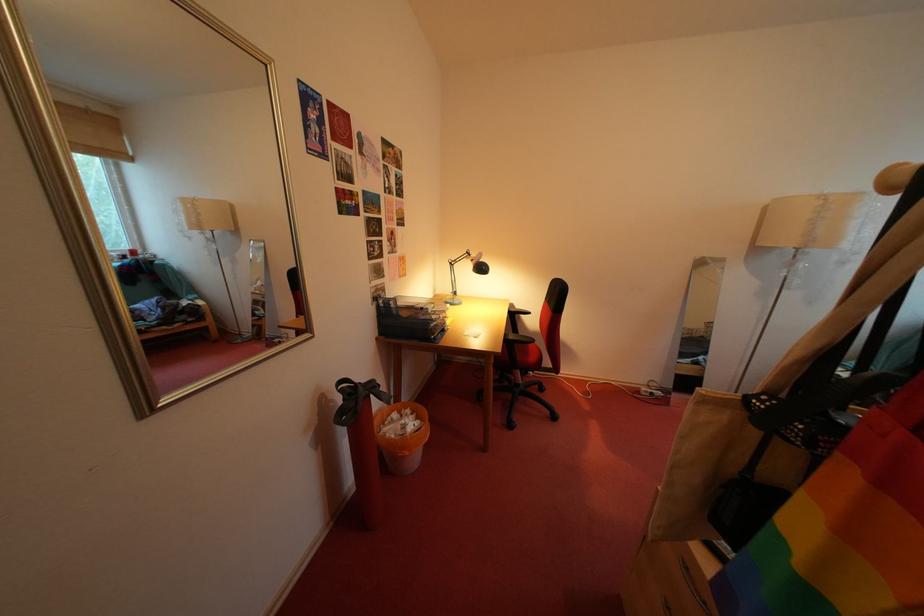
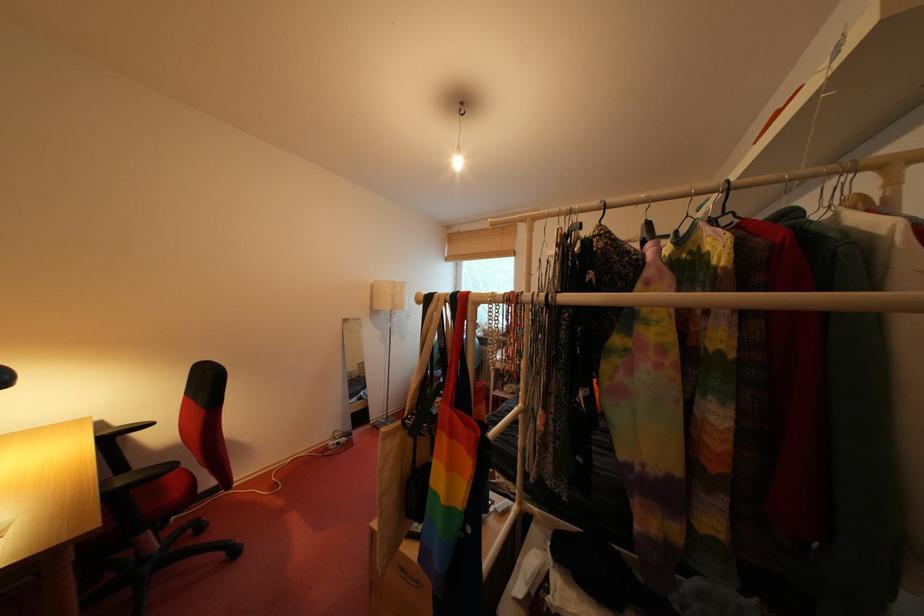
Find the pixel in the second image that matches pixel 529 312 in the first image.

(131, 426)